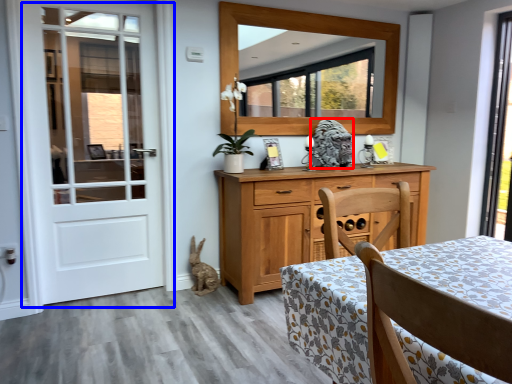
Question: Which object appears closest to the camera in this image, animal (highlighted by a red box) or door (highlighted by a blue box)?

Choices:
 (A) animal
 (B) door

Answer: (B)